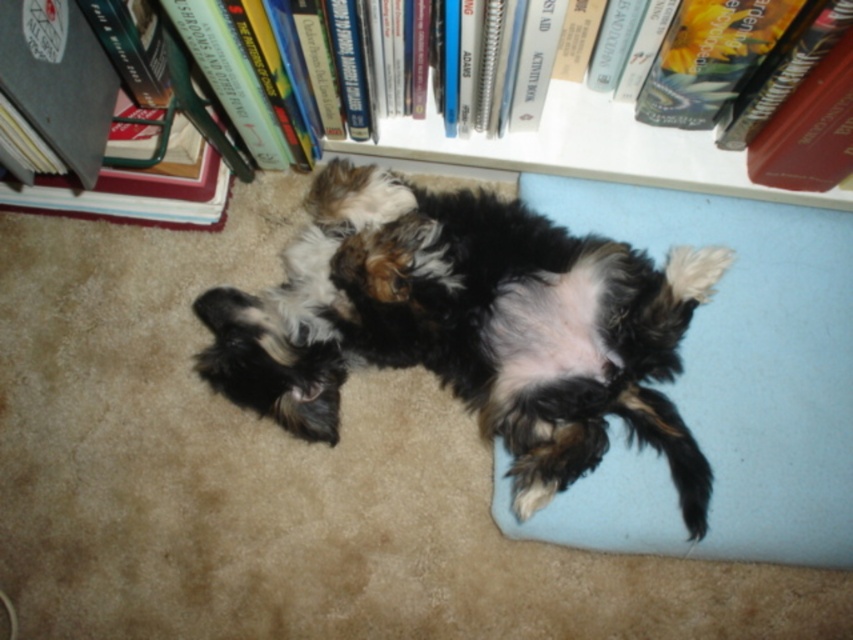
Question: Can you confirm if light blue fabric dog bed at lower right is positioned to the left of hardcover book at left?

Choices:
 (A) yes
 (B) no

Answer: (B)

Question: Does fluffy fur dog at center appear under light blue fabric dog bed at lower right?

Choices:
 (A) no
 (B) yes

Answer: (A)

Question: Which of these objects is positioned closest to the hardcover book at left?

Choices:
 (A) light blue fabric dog bed at lower right
 (B) white plastic bookcase at upper center

Answer: (B)

Question: Which point is closer to the camera?

Choices:
 (A) (596, 227)
 (B) (51, 106)
 (C) (474, 369)

Answer: (B)

Question: Which object is farther from the camera taking this photo?

Choices:
 (A) hardcover book at left
 (B) light blue fabric dog bed at lower right
 (C) fluffy fur dog at center
 (D) white plastic bookcase at upper center

Answer: (B)

Question: Observing the image, what is the correct spatial positioning of light blue fabric dog bed at lower right in reference to hardcover book at left?

Choices:
 (A) above
 (B) below

Answer: (B)